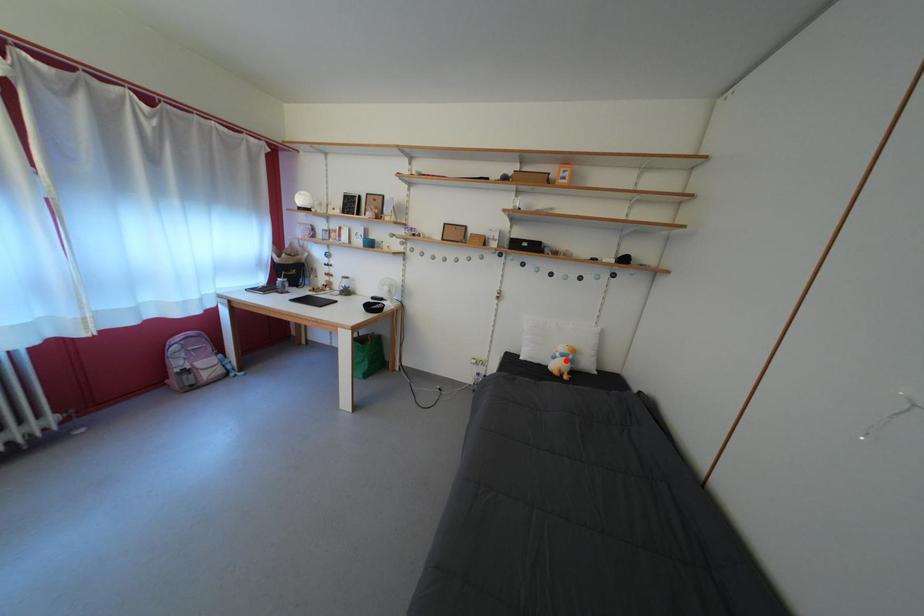
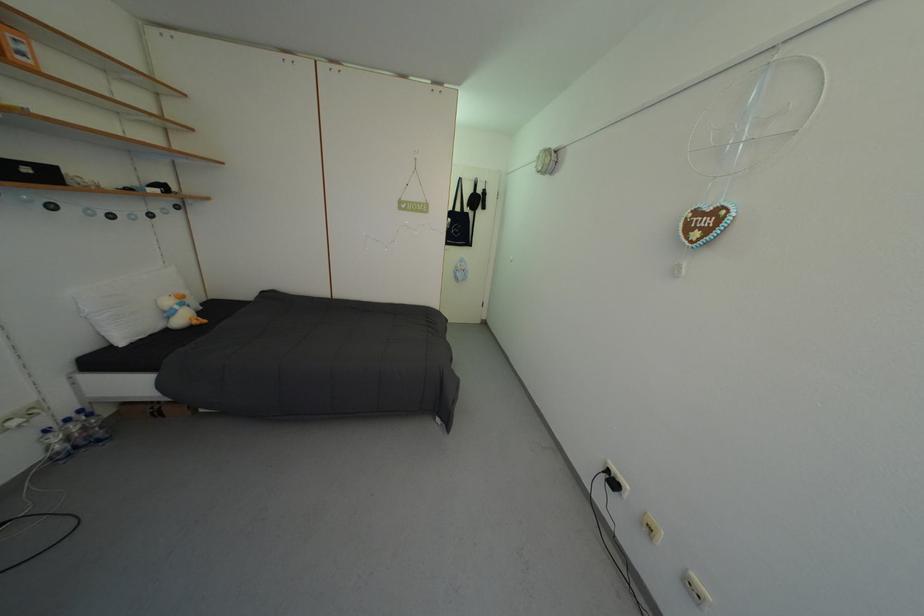
Question: A red point is marked in image1. In image2, is the corresponding 3D point closer to the camera or farther? Reply with the corresponding letter.

Choices:
 (A) The corresponding 3D point is closer.
 (B) The corresponding 3D point is farther.

Answer: (A)